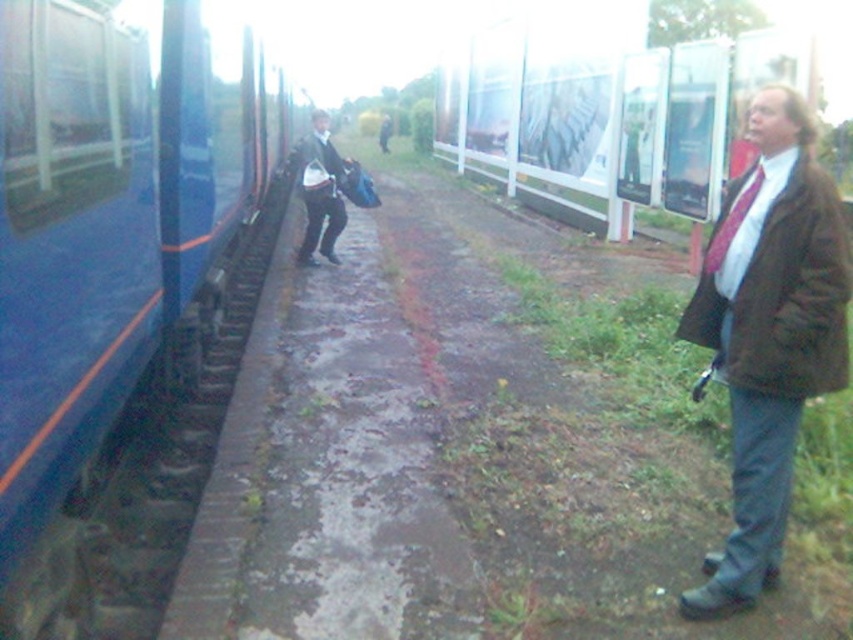
Question: Which of the following is the farthest from the observer?

Choices:
 (A) blue glossy train at left
 (B) matte brown jacket at right
 (C) dark brown leather jacket at center

Answer: (C)

Question: Which point is closer to the camera?

Choices:
 (A) (326, 227)
 (B) (836, 308)

Answer: (B)

Question: Which point is closer to the camera?

Choices:
 (A) tap(45, 301)
 (B) tap(810, 177)
 (C) tap(311, 209)

Answer: (A)

Question: Does blue glossy train at left have a greater width compared to dark brown leather jacket at center?

Choices:
 (A) no
 (B) yes

Answer: (A)

Question: Observing the image, what is the correct spatial positioning of matte brown jacket at right in reference to dark brown leather jacket at center?

Choices:
 (A) right
 (B) left

Answer: (A)

Question: Can you confirm if blue glossy train at left is positioned below matte brown jacket at right?

Choices:
 (A) no
 (B) yes

Answer: (A)